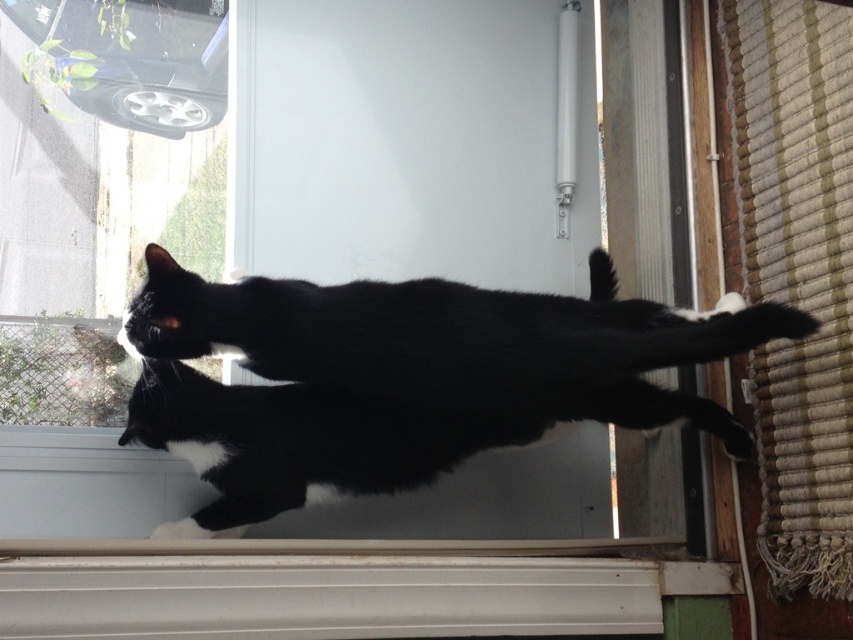
Looking at this image, you are trying to determine if the black fur cat at center can fit through the transparent glass screen door at center. Based on their sizes, can the cat pass through?

The transparent glass screen door at center is bigger than black fur cat at center, so the cat can pass through.

You are a delivery person approaching the transparent glass screen door at center. There is a black fur cat at center nearby. Which object is closer to you as you approach the door?

The transparent glass screen door at center is closer to you than the black fur cat at center because the description states that the door is further to the viewer than the cat. Wait, that seems contradictory. Let me check again. The description says the door is further to the viewer than the cat, meaning the cat is behind the door. Therefore, as you approach the door, the door itself is closer to you, while the cat is behind it, making the door the closer object.

You are a photographer trying to capture the two cats through the glass door. You notice two points on the glass door at coordinates point (474, 216) and point (467, 376). Which point is closer to your camera?

Point (474, 216) is further to the camera than point (467, 376), so the point closer to the camera is point (467, 376).